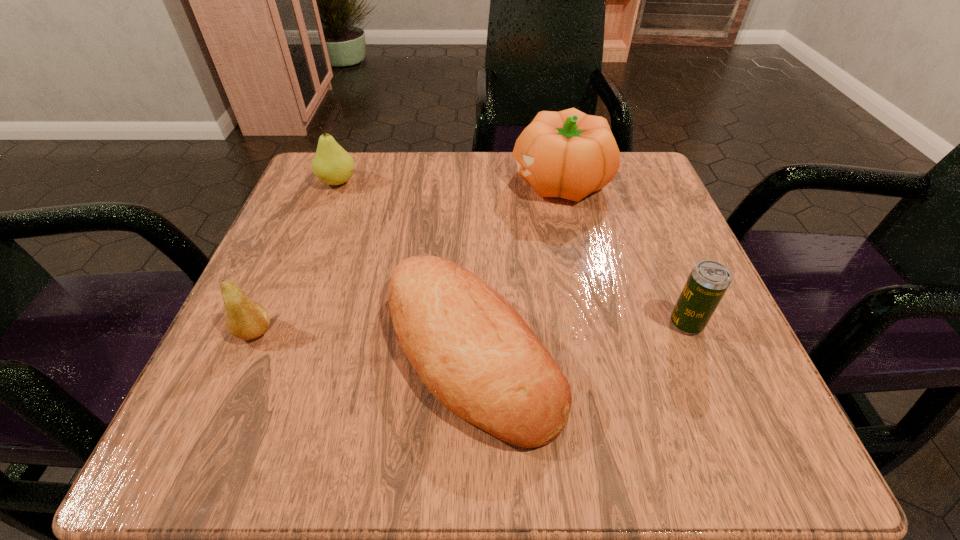
The image size is (960, 540). I want to click on the tallest object, so click(x=568, y=154).

Where is `the farther pear`? The height and width of the screenshot is (540, 960). the farther pear is located at coordinates pos(331,164).

Identify the location of the rightmost object. (708, 281).

Where is `the nearer pear`? This screenshot has width=960, height=540. the nearer pear is located at coordinates (245, 319).

At what (x,y) coordinates should I click in order to perform the action: click on bread. Please return your answer as a coordinate pair (x, y). The height and width of the screenshot is (540, 960). Looking at the image, I should click on (473, 351).

Image resolution: width=960 pixels, height=540 pixels. I want to click on vacant space located on the carved face of the tallest object, so click(453, 181).

Where is `blank space located 0.220m on the carved face of the tallest object`? blank space located 0.220m on the carved face of the tallest object is located at coordinates (405, 181).

The height and width of the screenshot is (540, 960). In order to click on vacant space located 0.170m on the carved face of the tallest object in this screenshot , I will do `click(429, 181)`.

Locate an element on the screen. vacant space located on the front of the taller pear is located at coordinates (296, 288).

Where is `free spot located on the left of the beer can`? free spot located on the left of the beer can is located at coordinates (464, 323).